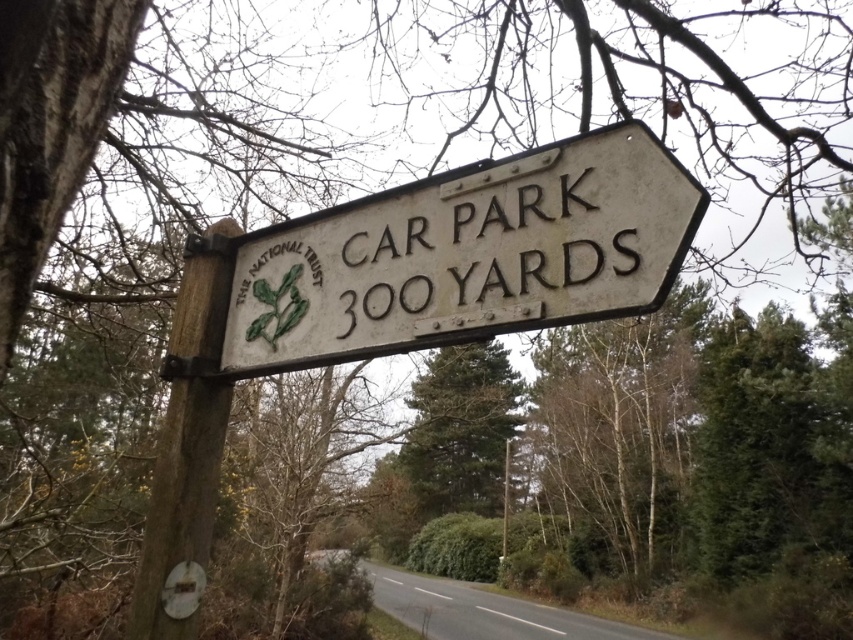
Question: Among these objects, which one is farthest from the camera?

Choices:
 (A) brown wood pole at left
 (B) white wooden sign at center

Answer: (A)

Question: Does white wooden sign at center have a smaller size compared to brown wood pole at left?

Choices:
 (A) no
 (B) yes

Answer: (A)

Question: Does white wooden sign at center lie in front of brown wood pole at left?

Choices:
 (A) yes
 (B) no

Answer: (A)

Question: Which point is closer to the camera?

Choices:
 (A) (296, 307)
 (B) (196, 433)

Answer: (A)

Question: Which object appears farthest from the camera in this image?

Choices:
 (A) brown wood pole at left
 (B) white wooden sign at center

Answer: (A)

Question: Is white wooden sign at center smaller than brown wood pole at left?

Choices:
 (A) no
 (B) yes

Answer: (A)